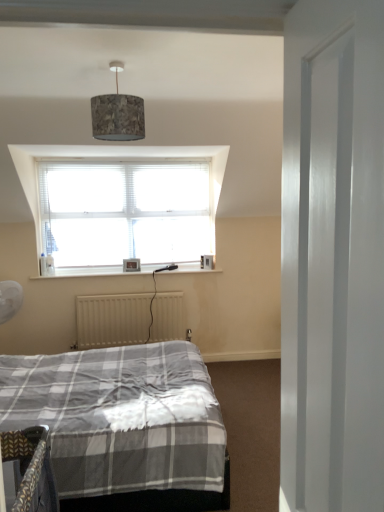
The width and height of the screenshot is (384, 512). Identify the location of beige matte radiator at lower center. (128, 319).

Describe the element at coordinates (128, 319) in the screenshot. I see `beige matte radiator at lower center` at that location.

This screenshot has height=512, width=384. Describe the element at coordinates (117, 114) in the screenshot. I see `textured fabric lampshade at upper center` at that location.

Where is `textured fabric lampshade at upper center`? The image size is (384, 512). textured fabric lampshade at upper center is located at coordinates (117, 114).

Identify the location of beige matte radiator at lower center. (128, 319).

Is beige matte radiator at lower center to the left or to the right of textured fabric lampshade at upper center in the image?

Based on their positions, beige matte radiator at lower center is located to the left of textured fabric lampshade at upper center.

Is beige matte radiator at lower center closer to the viewer compared to textured fabric lampshade at upper center?

No, beige matte radiator at lower center is behind textured fabric lampshade at upper center.

Which point is more forward, (118, 318) or (100, 119)?

The point (100, 119) is closer to the camera.

From the image's perspective, is beige matte radiator at lower center above or below textured fabric lampshade at upper center?

beige matte radiator at lower center is situated lower than textured fabric lampshade at upper center in the image.

From a real-world perspective, who is located lower, beige matte radiator at lower center or textured fabric lampshade at upper center?

beige matte radiator at lower center.

Does beige matte radiator at lower center have a greater width compared to textured fabric lampshade at upper center?

No.

Does beige matte radiator at lower center have a greater height compared to textured fabric lampshade at upper center?

Correct, beige matte radiator at lower center is much taller as textured fabric lampshade at upper center.

Who is bigger, beige matte radiator at lower center or textured fabric lampshade at upper center?

Bigger between the two is beige matte radiator at lower center.

Is beige matte radiator at lower center not within textured fabric lampshade at upper center?

That's correct, beige matte radiator at lower center is outside of textured fabric lampshade at upper center.

Is beige matte radiator at lower center positioned far away from textured fabric lampshade at upper center?

beige matte radiator at lower center is far away from textured fabric lampshade at upper center.

Is beige matte radiator at lower center positioned with its back to textured fabric lampshade at upper center?

That's not correct — beige matte radiator at lower center is not looking away from textured fabric lampshade at upper center.

How far apart are beige matte radiator at lower center and textured fabric lampshade at upper center?

beige matte radiator at lower center and textured fabric lampshade at upper center are 2.19 meters apart from each other.

Identify the location of lamp in front of the beige matte radiator at lower center. Image resolution: width=384 pixels, height=512 pixels. (117, 114).

Can you confirm if textured fabric lampshade at upper center is positioned to the right of beige matte radiator at lower center?

Indeed, textured fabric lampshade at upper center is positioned on the right side of beige matte radiator at lower center.

Is textured fabric lampshade at upper center in front of or behind beige matte radiator at lower center in the image?

textured fabric lampshade at upper center is positioned closer to the viewer than beige matte radiator at lower center.

Considering the positions of point (112, 62) and point (85, 335), is point (112, 62) closer or farther from the camera than point (85, 335)?

Point (112, 62) is positioned closer to the camera compared to point (85, 335).

From the image's perspective, which is below, textured fabric lampshade at upper center or beige matte radiator at lower center?

beige matte radiator at lower center appears lower in the image.

From a real-world perspective, which object rests below the other?

beige matte radiator at lower center is physically lower.

Which object is wider, textured fabric lampshade at upper center or beige matte radiator at lower center?

With larger width is textured fabric lampshade at upper center.

From their relative heights in the image, would you say textured fabric lampshade at upper center is taller or shorter than beige matte radiator at lower center?

textured fabric lampshade at upper center is shorter than beige matte radiator at lower center.

Considering the sizes of objects textured fabric lampshade at upper center and beige matte radiator at lower center in the image provided, who is bigger, textured fabric lampshade at upper center or beige matte radiator at lower center?

beige matte radiator at lower center.

Is beige matte radiator at lower center completely or partially inside textured fabric lampshade at upper center?

No, textured fabric lampshade at upper center does not contain beige matte radiator at lower center.

Are textured fabric lampshade at upper center and beige matte radiator at lower center making contact?

textured fabric lampshade at upper center and beige matte radiator at lower center are clearly separated.

Is textured fabric lampshade at upper center oriented away from beige matte radiator at lower center?

No, beige matte radiator at lower center is not at the back of textured fabric lampshade at upper center.

How different are the orientations of textured fabric lampshade at upper center and beige matte radiator at lower center in degrees?

The facing directions of textured fabric lampshade at upper center and beige matte radiator at lower center are 0.217 degrees apart.

How far apart are textured fabric lampshade at upper center and beige matte radiator at lower center?

textured fabric lampshade at upper center and beige matte radiator at lower center are 2.19 meters apart from each other.

Where is `radiator below the textured fabric lampshade at upper center (from the image's perspective)`? This screenshot has width=384, height=512. radiator below the textured fabric lampshade at upper center (from the image's perspective) is located at coordinates pyautogui.click(x=128, y=319).

You are a GUI agent. You are given a task and a screenshot of the screen. Output one action in this format:
    pyautogui.click(x=<x>, y=<y>)
    Task: Click on the lamp above the beige matte radiator at lower center (from the image's perspective)
    
    Given the screenshot: What is the action you would take?
    click(117, 114)

Where is `lamp above the beige matte radiator at lower center (from a real-world perspective)`? The height and width of the screenshot is (512, 384). lamp above the beige matte radiator at lower center (from a real-world perspective) is located at coordinates (117, 114).